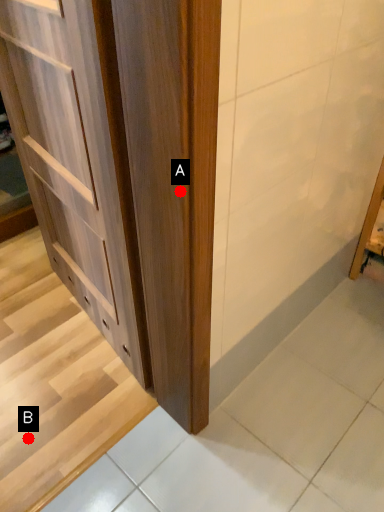
Question: Two points are circled on the image, labeled by A and B beside each circle. Which point is further to the camera?

Choices:
 (A) A is further
 (B) B is further

Answer: (B)